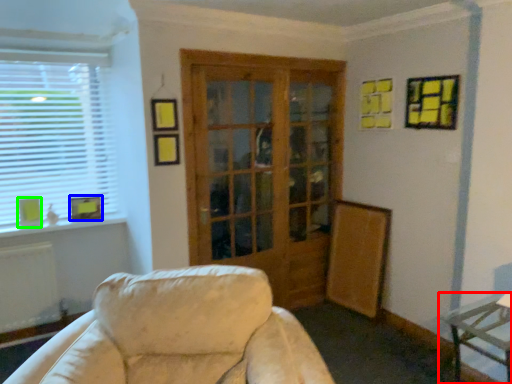
Question: Which is farther away from table (highlighted by a red box)? picture frame (highlighted by a blue box) or picture frame (highlighted by a green box)?

Choices:
 (A) picture frame
 (B) picture frame

Answer: (B)